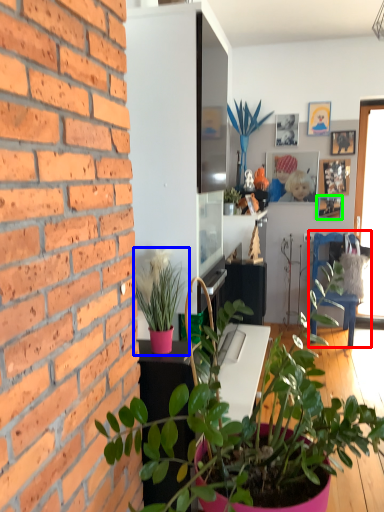
Question: Which object is positioned closest to armchair (highlighted by a red box)? Select from houseplant (highlighted by a blue box) and picture frame (highlighted by a green box).

Choices:
 (A) houseplant
 (B) picture frame

Answer: (B)